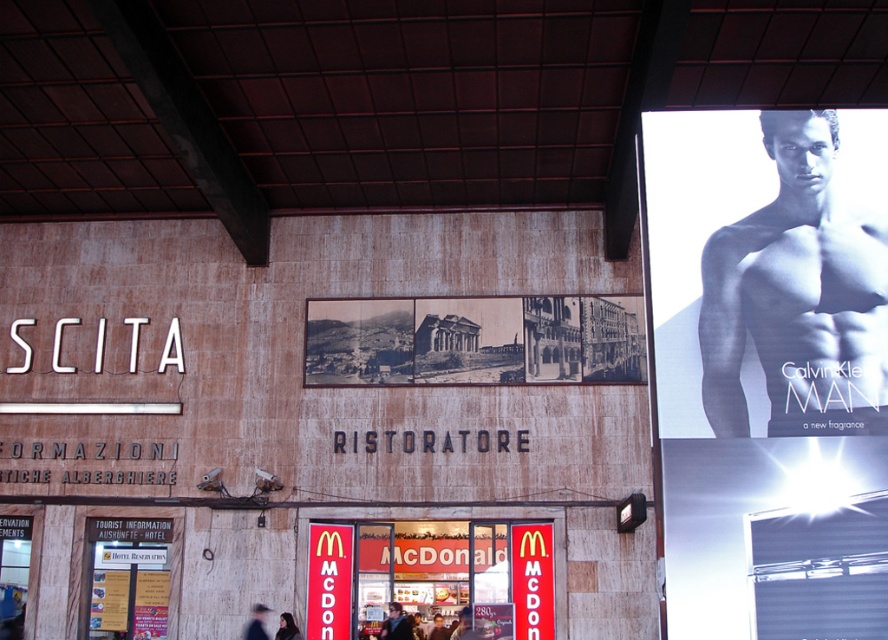
Question: Can you confirm if black skin at upper right is positioned to the right of red signboard at center?

Choices:
 (A) yes
 (B) no

Answer: (A)

Question: Among these points, which one is nearest to the camera?

Choices:
 (A) (823, 268)
 (B) (283, 625)

Answer: (A)

Question: Among these points, which one is farthest from the camera?

Choices:
 (A) (299, 634)
 (B) (322, 589)

Answer: (B)

Question: Estimate the real-world distances between objects in this image. Which object is closer to the smooth skin man at upper right?

Choices:
 (A) red signboard at center
 (B) dark brown hair at lower left

Answer: (B)

Question: Is black skin at upper right bigger than dark brown hair at lower left?

Choices:
 (A) no
 (B) yes

Answer: (B)

Question: Is white paper poster at upper right positioned behind smooth skin man at upper right?

Choices:
 (A) yes
 (B) no

Answer: (B)